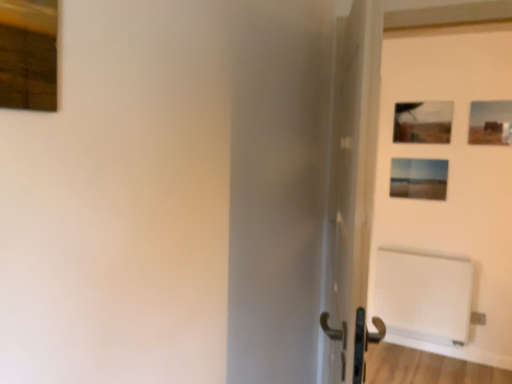
Question: Is matte wooden picture frame at center-right, positioned as the 1th picture frame in back-to-front order, facing away from matte black picture frame at upper right, marked as the second picture frame in a right-to-left arrangement?

Choices:
 (A) no
 (B) yes

Answer: (A)

Question: Can you confirm if matte wooden picture frame at center-right, positioned as the 1th picture frame in back-to-front order, is wider than matte black picture frame at upper right, which is the 3th picture frame from left to right?

Choices:
 (A) no
 (B) yes

Answer: (B)

Question: From the image's perspective, is matte wooden picture frame at center-right, placed as the 3th picture frame when sorted from right to left, over matte black picture frame at upper right, marked as the second picture frame in a right-to-left arrangement?

Choices:
 (A) yes
 (B) no

Answer: (B)

Question: Does matte wooden picture frame at center-right, placed as the 3th picture frame when sorted from right to left, have a lesser width compared to matte black picture frame at upper right, marked as the second picture frame in a right-to-left arrangement?

Choices:
 (A) no
 (B) yes

Answer: (A)

Question: Considering the relative sizes of matte wooden picture frame at center-right, placed as the 3th picture frame when sorted from right to left, and matte black picture frame at upper right, marked as the second picture frame in a right-to-left arrangement, in the image provided, is matte wooden picture frame at center-right, placed as the 3th picture frame when sorted from right to left, shorter than matte black picture frame at upper right, marked as the second picture frame in a right-to-left arrangement,?

Choices:
 (A) no
 (B) yes

Answer: (B)

Question: Considering the relative positions of matte wooden picture frame at center-right, which ranks as the fourth picture frame in front-to-back order, and matte black picture frame at upper right, marked as the second picture frame in a right-to-left arrangement, in the image provided, is matte wooden picture frame at center-right, which ranks as the fourth picture frame in front-to-back order, to the left of matte black picture frame at upper right, marked as the second picture frame in a right-to-left arrangement, from the viewer's perspective?

Choices:
 (A) yes
 (B) no

Answer: (A)

Question: Is white matte door at center surrounding matte wooden picture frame at center-right, which ranks as the fourth picture frame in front-to-back order?

Choices:
 (A) no
 (B) yes

Answer: (A)

Question: Is white matte door at center with matte wooden picture frame at center-right, placed as the 3th picture frame when sorted from right to left?

Choices:
 (A) no
 (B) yes

Answer: (A)

Question: Considering the relative sizes of white matte door at center and matte wooden picture frame at center-right, positioned as the 1th picture frame in back-to-front order, in the image provided, is white matte door at center wider than matte wooden picture frame at center-right, positioned as the 1th picture frame in back-to-front order,?

Choices:
 (A) yes
 (B) no

Answer: (A)

Question: Considering the relative positions of white matte door at center and matte wooden picture frame at center-right, which ranks as the fourth picture frame in front-to-back order, in the image provided, is white matte door at center behind matte wooden picture frame at center-right, which ranks as the fourth picture frame in front-to-back order,?

Choices:
 (A) yes
 (B) no

Answer: (B)

Question: From the image's perspective, is white matte door at center on top of matte wooden picture frame at center-right, which ranks as the fourth picture frame in front-to-back order?

Choices:
 (A) yes
 (B) no

Answer: (B)

Question: Is white matte door at center taller than matte wooden picture frame at center-right, placed as the 3th picture frame when sorted from right to left?

Choices:
 (A) no
 (B) yes

Answer: (B)

Question: Is matte wooden picture frame at center-right, placed as the 3th picture frame when sorted from right to left, positioned far away from wooden frame at upper left, the 4th picture frame from the back?

Choices:
 (A) no
 (B) yes

Answer: (B)